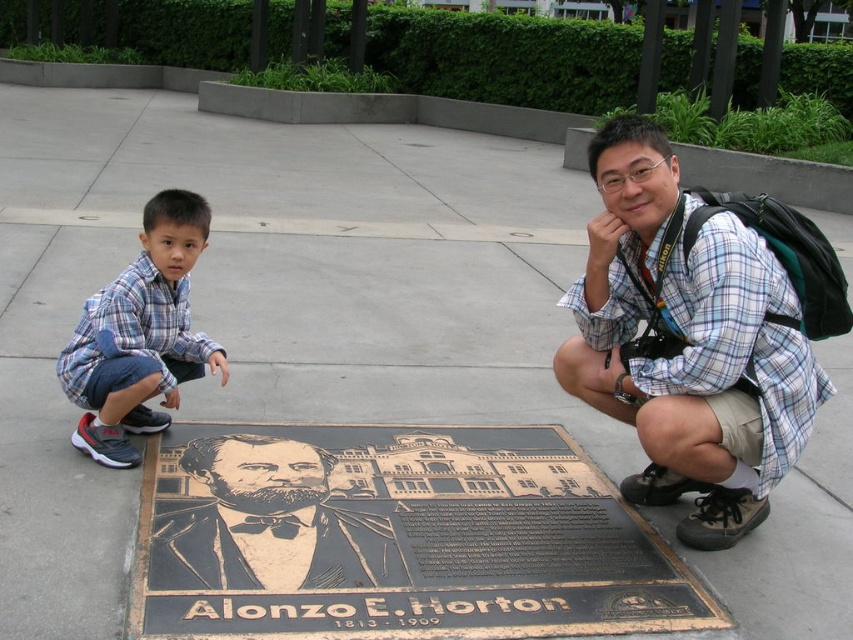
Can you confirm if plaid shirt at center is positioned to the right of matte bronze portrait at center?

Correct, you'll find plaid shirt at center to the right of matte bronze portrait at center.

Does point (704, 381) come closer to viewer compared to point (352, 576)?

Yes, it is.

What are the coordinates of `plaid shirt at center` in the screenshot? It's located at (699, 332).

Is matte bronze portrait at center positioned before blue plaid shirt at left?

Yes, it is in front of blue plaid shirt at left.

Between matte bronze portrait at center and blue plaid shirt at left, which one is positioned higher?

blue plaid shirt at left is above.

Who is more forward, (323,509) or (115,458)?

Positioned in front is point (323,509).

Identify the location of matte bronze portrait at center. Image resolution: width=853 pixels, height=640 pixels. (270, 516).

Locate an element on the screen. The height and width of the screenshot is (640, 853). plaid shirt at center is located at coordinates (699, 332).

Between plaid shirt at center and blue plaid shirt at left, which one has more height?

plaid shirt at center is taller.

Is point (625, 387) positioned in front of point (183, 260)?

That is True.

Where is `plaid shirt at center`? This screenshot has height=640, width=853. plaid shirt at center is located at coordinates (699, 332).